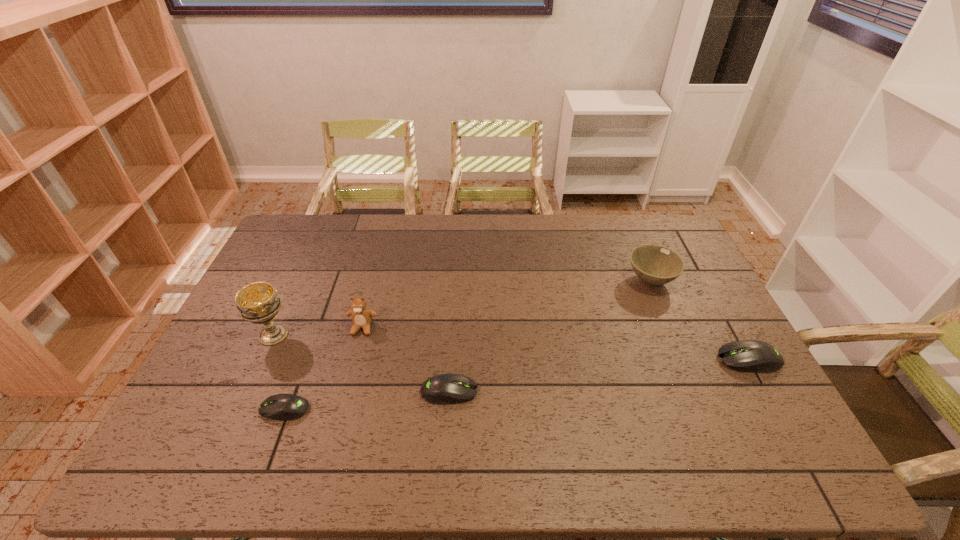
The width and height of the screenshot is (960, 540). Identify the location of teddy bear. (361, 316).

Locate an element on the screen. vacant area situated on the wheel side of the second computer mouse from left to right is located at coordinates (527, 392).

Find the location of `vacant space situated on the wheel side of the rightmost object`. vacant space situated on the wheel side of the rightmost object is located at coordinates (618, 360).

Find the location of `vacant area situated 0.360m on the wheel side of the rightmost object`. vacant area situated 0.360m on the wheel side of the rightmost object is located at coordinates (589, 360).

At what (x,y) coordinates should I click in order to perform the action: click on free space located on the wheel side of the rightmost object. Please return your answer as a coordinate pair (x, y). Looking at the image, I should click on (629, 360).

Where is `free region located 0.070m on the back of the bowl`? free region located 0.070m on the back of the bowl is located at coordinates (638, 252).

Locate an element on the screen. The height and width of the screenshot is (540, 960). vacant space located on the back of the chalice is located at coordinates (304, 266).

The height and width of the screenshot is (540, 960). Find the location of `free point located on the front-facing side of the second tallest object`. free point located on the front-facing side of the second tallest object is located at coordinates (341, 410).

Where is `object that is at the left edge`? The height and width of the screenshot is (540, 960). object that is at the left edge is located at coordinates (258, 302).

Where is `computer mouse at the right edge`? The image size is (960, 540). computer mouse at the right edge is located at coordinates (753, 356).